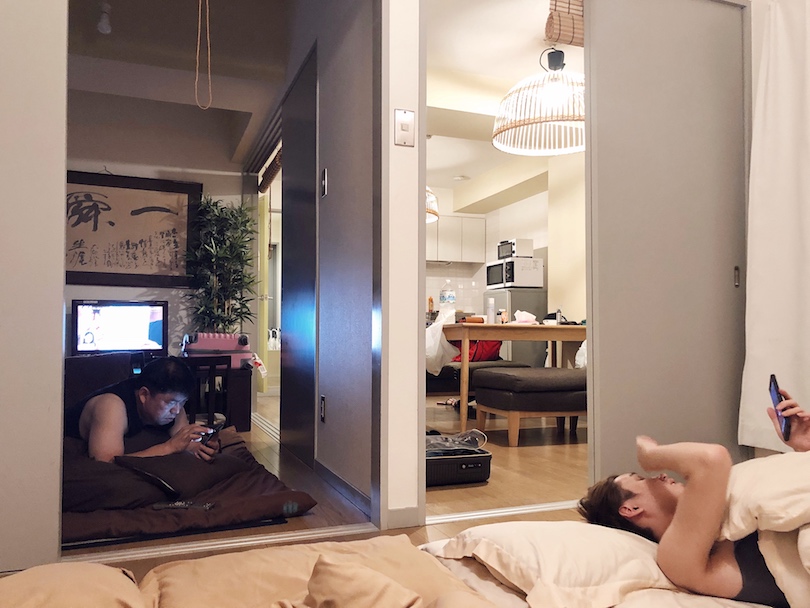
Find the location of a particular element. lights is located at coordinates (552, 114), (431, 206).